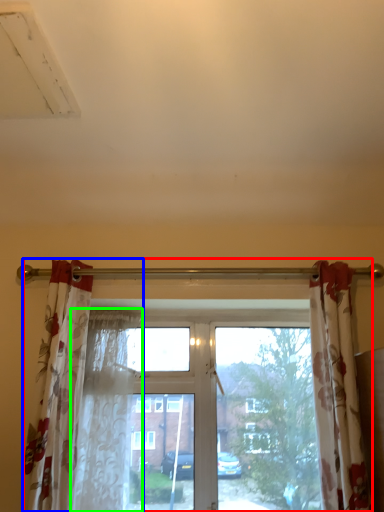
Question: Which object is positioned farthest from window (highlighted by a red box)? Select from curtain (highlighted by a blue box) and shower curtain (highlighted by a green box).

Choices:
 (A) curtain
 (B) shower curtain

Answer: (A)